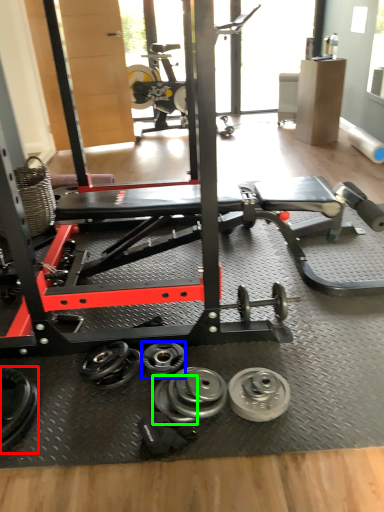
Question: Considering the real-world distances, which object is closest to dumbbell (highlighted by a red box)? dumbbell (highlighted by a blue box) or wheel (highlighted by a green box).

Choices:
 (A) dumbbell
 (B) wheel

Answer: (B)